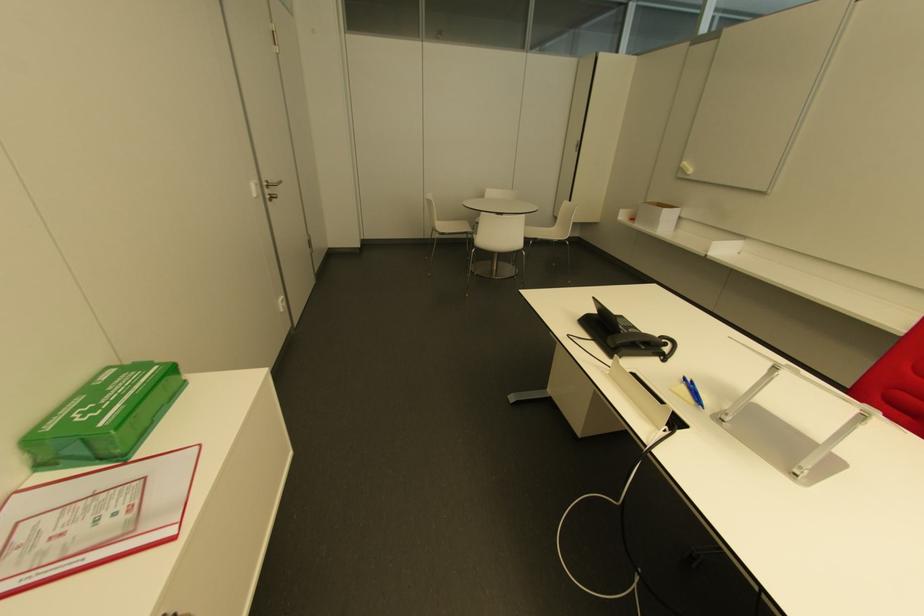
Where would you lift the black telephone handset? Please return your answer as a coordinate pair (x, y).

(640, 342)